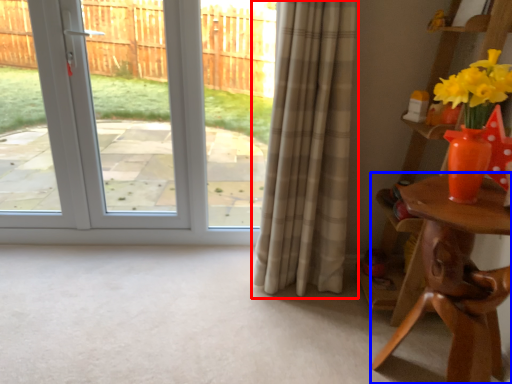
Question: Among these objects, which one is farthest to the camera, curtain (highlighted by a red box) or table (highlighted by a blue box)?

Choices:
 (A) curtain
 (B) table

Answer: (A)